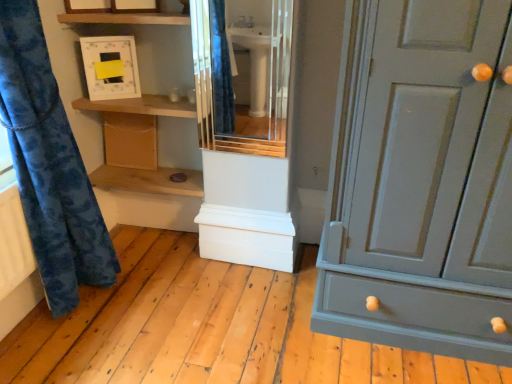
Question: Should I look upward or downward to see matte white cabinet at center?

Choices:
 (A) down
 (B) up

Answer: (B)

Question: Can you confirm if wooden cabinet at lower left is thinner than wooden shelf at upper center, the 2th shelf ordered from the bottom?

Choices:
 (A) no
 (B) yes

Answer: (B)

Question: From a real-world perspective, is wooden cabinet at lower left under wooden shelf at upper center, the 2th shelf ordered from the bottom?

Choices:
 (A) yes
 (B) no

Answer: (A)

Question: Is wooden cabinet at lower left aimed at wooden shelf at upper center, the 2th shelf ordered from the bottom?

Choices:
 (A) yes
 (B) no

Answer: (B)

Question: Is wooden cabinet at lower left at the right side of wooden shelf at upper center, which is the first shelf in top-to-bottom order?

Choices:
 (A) yes
 (B) no

Answer: (B)

Question: Does wooden cabinet at lower left have a smaller size compared to wooden shelf at upper center, the 2th shelf ordered from the bottom?

Choices:
 (A) yes
 (B) no

Answer: (A)

Question: Does wooden cabinet at lower left lie in front of wooden shelf at upper center, which is the first shelf in top-to-bottom order?

Choices:
 (A) yes
 (B) no

Answer: (B)

Question: From the image's perspective, would you say matte white medicine cabinet at upper center is shown under wooden shelf at center, the second shelf from the top?

Choices:
 (A) yes
 (B) no

Answer: (B)

Question: Does matte white medicine cabinet at upper center come behind wooden shelf at center, acting as the first shelf starting from the bottom?

Choices:
 (A) no
 (B) yes

Answer: (A)

Question: Is matte white medicine cabinet at upper center oriented away from wooden shelf at center, the second shelf from the top?

Choices:
 (A) yes
 (B) no

Answer: (B)

Question: From a real-world perspective, is matte white medicine cabinet at upper center beneath wooden shelf at center, the second shelf from the top?

Choices:
 (A) yes
 (B) no

Answer: (B)

Question: Does matte white medicine cabinet at upper center have a smaller size compared to wooden shelf at center, the second shelf from the top?

Choices:
 (A) no
 (B) yes

Answer: (B)

Question: Is matte white medicine cabinet at upper center closer to camera compared to wooden shelf at center, acting as the first shelf starting from the bottom?

Choices:
 (A) no
 (B) yes

Answer: (B)

Question: Is wooden shelf at upper center, the 2th shelf ordered from the bottom, outside of matte gray cabinet at right?

Choices:
 (A) yes
 (B) no

Answer: (A)